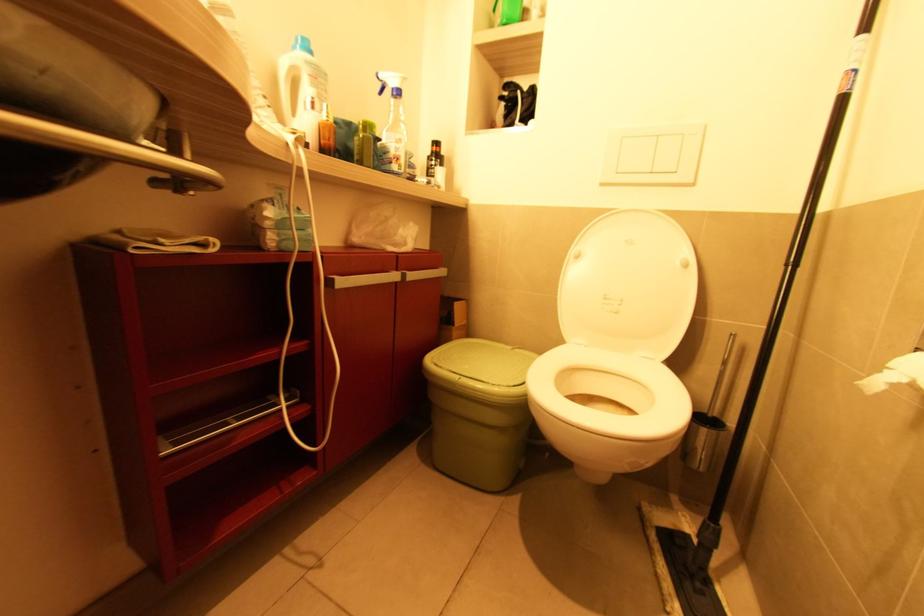
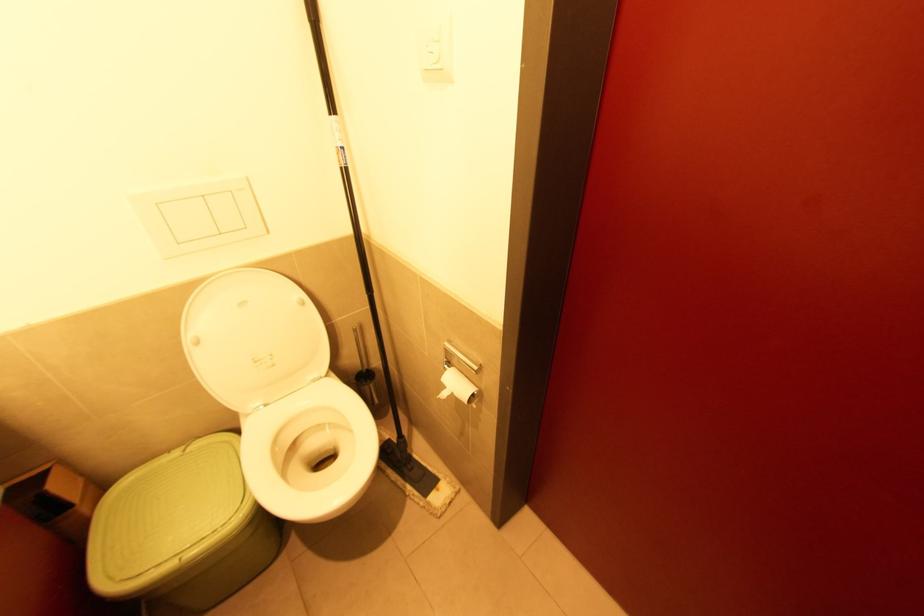
The point at (515,349) is marked in the first image. Where is the corresponding point in the second image?

(187, 452)